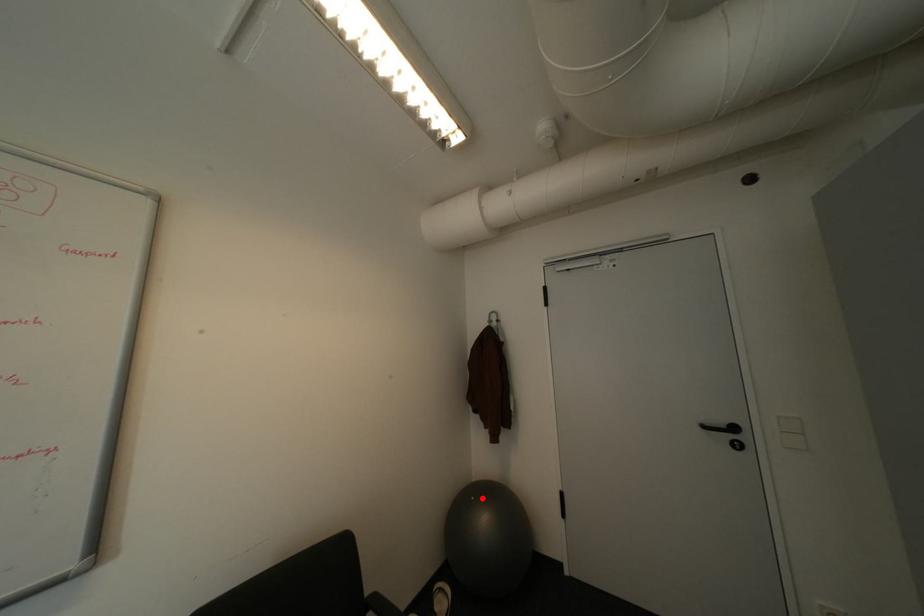
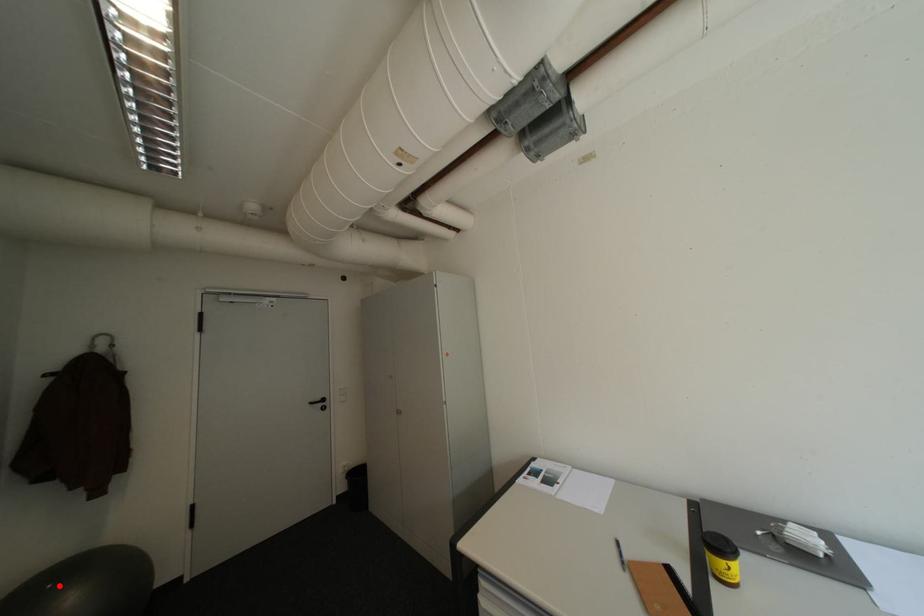
I am providing you with two images of the same scene from different viewpoints. A red point is marked on the first image and another point is marked on the second image. Does the point marked in image1 correspond to the same location as the one in image2?

Yes